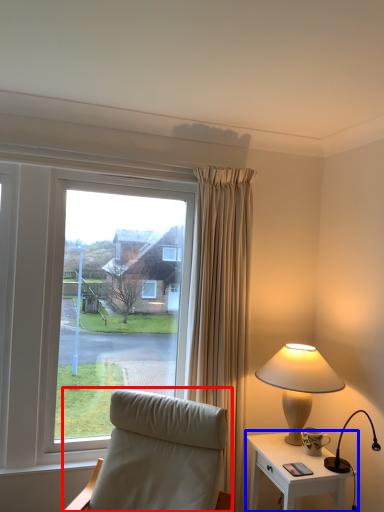
Question: Which object is closer to the camera taking this photo, chair (highlighted by a red box) or nightstand (highlighted by a blue box)?

Choices:
 (A) chair
 (B) nightstand

Answer: (A)